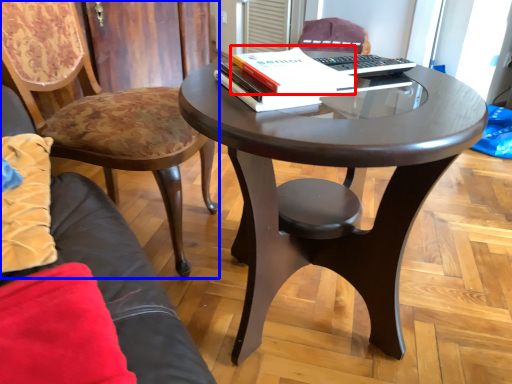
Question: Which object appears closest to the camera in this image, paperback book (highlighted by a red box) or chair (highlighted by a blue box)?

Choices:
 (A) paperback book
 (B) chair

Answer: (A)